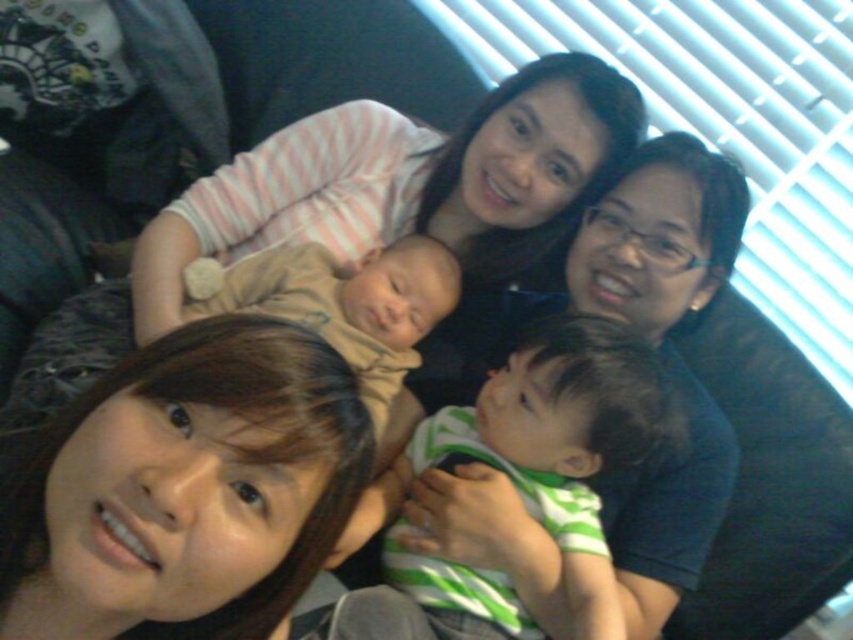
Question: Which object is the farthest from the soft beige fabric baby at center?

Choices:
 (A) green striped shirt at center
 (B) brown hair at lower left

Answer: (B)

Question: Observing the image, what is the correct spatial positioning of brown hair at lower left in reference to green striped shirt at center?

Choices:
 (A) right
 (B) left

Answer: (B)

Question: Among these points, which one is farthest from the camera?

Choices:
 (A) (570, 416)
 (B) (422, 291)

Answer: (B)

Question: In this image, where is brown hair at lower left located relative to green striped shirt at center?

Choices:
 (A) left
 (B) right

Answer: (A)

Question: Observing the image, what is the correct spatial positioning of brown hair at lower left in reference to soft beige fabric baby at center?

Choices:
 (A) above
 (B) below

Answer: (B)

Question: Which point is farther from the camera taking this photo?

Choices:
 (A) (67, 468)
 (B) (605, 388)

Answer: (B)